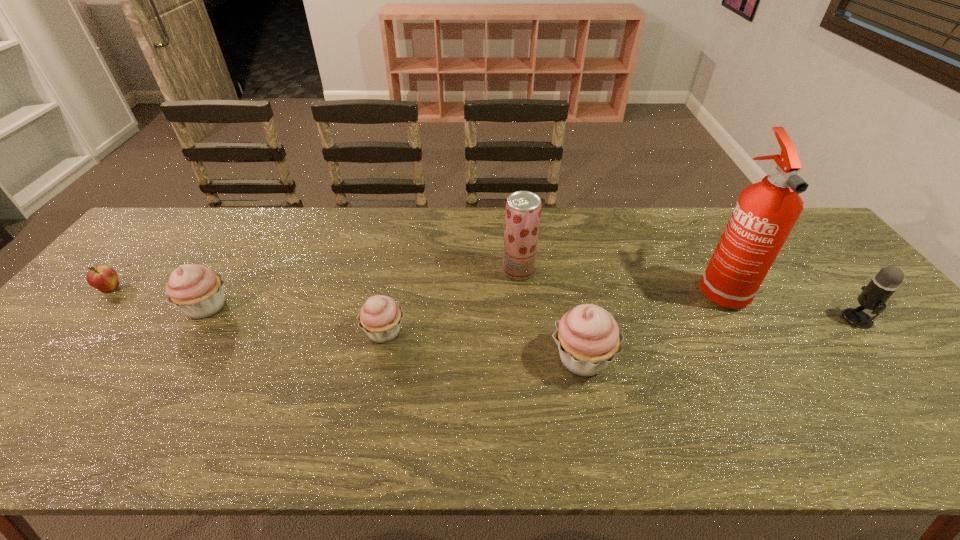
Observe the arrangement of all cupcakes in the image. To keep them evenly spaced, where would you place another cupcake on the right? Please locate a free space. Please provide its 2D coordinates. Your answer should be formatted as a tuple, i.e. [(x, y)], where the tuple contains the x and y coordinates of a point satisfying the conditions above.

[(805, 389)]